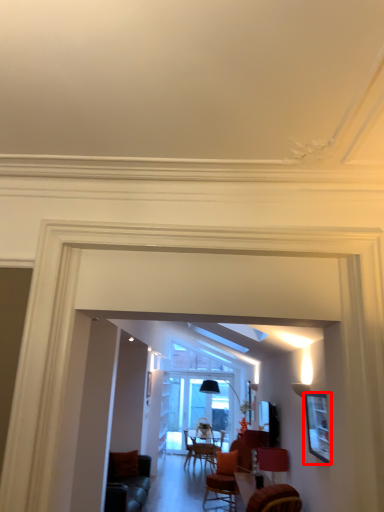
Question: In this image, where is picture frame (annotated by the red box) located relative to lamp?

Choices:
 (A) right
 (B) left

Answer: (A)